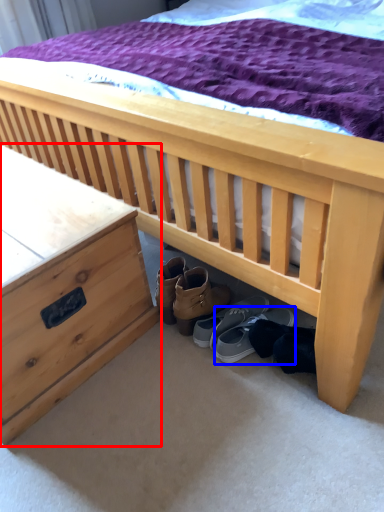
Question: Which of the following is the closest to the observer, nightstand (highlighted by a red box) or footwear (highlighted by a blue box)?

Choices:
 (A) nightstand
 (B) footwear

Answer: (A)